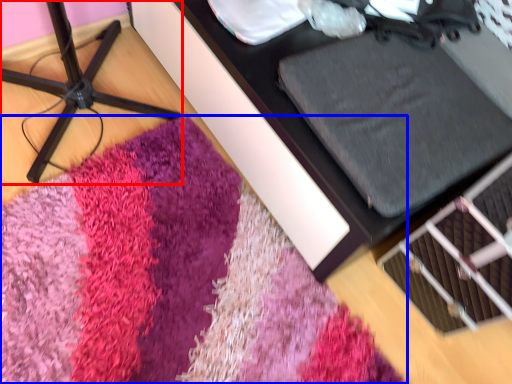
Question: Among these objects, which one is farthest to the camera, furniture (highlighted by a red box) or mat (highlighted by a blue box)?

Choices:
 (A) furniture
 (B) mat

Answer: (B)